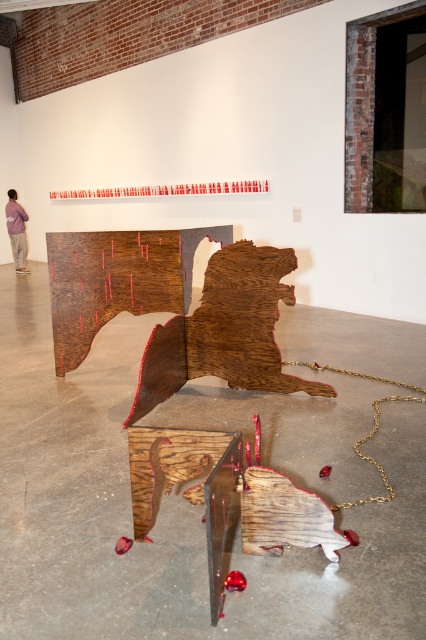
Does wooden sculpture at center appear under purple cotton shirt at upper left?

Correct, wooden sculpture at center is located below purple cotton shirt at upper left.

Which is more to the right, wooden sculpture at center or purple cotton shirt at upper left?

Positioned to the right is wooden sculpture at center.

Identify the location of wooden sculpture at center. The image size is (426, 640). (226, 330).

Which is above, wooden carving at center or purple cotton shirt at upper left?

purple cotton shirt at upper left is higher up.

Locate an element on the screen. The height and width of the screenshot is (640, 426). wooden carving at center is located at coordinates (117, 280).

Where is `wooden carving at center`? wooden carving at center is located at coordinates tap(117, 280).

Which is behind, point (247, 282) or point (178, 289)?

Point (247, 282)

Is wooden sculpture at center taller than wooden carving at center?

Incorrect, wooden sculpture at center's height is not larger of wooden carving at center's.

Does point (331, 394) come in front of point (75, 362)?

Yes.

Locate an element on the screen. This screenshot has width=426, height=640. wooden sculpture at center is located at coordinates (226, 330).